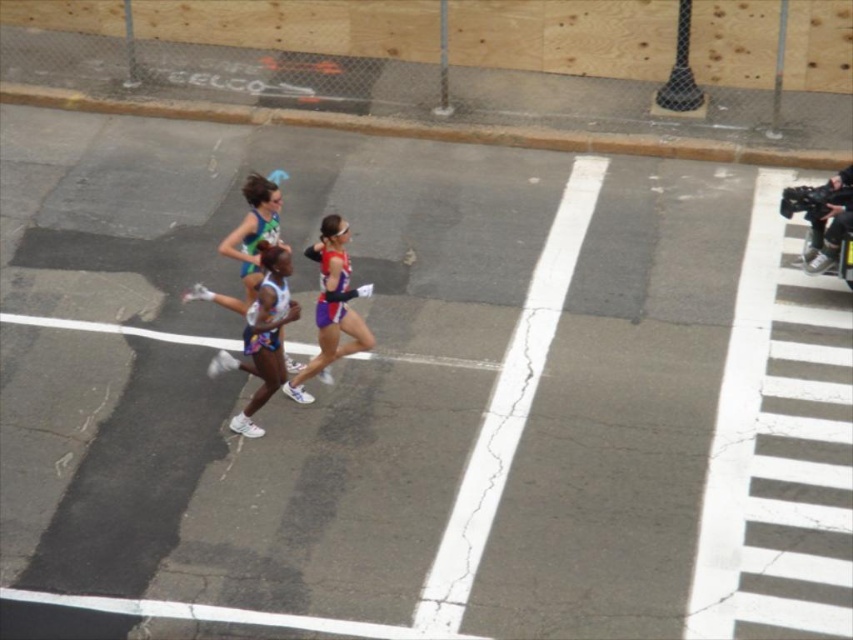
Question: Based on their relative distances, which object is farther from the white athletic wear at center?

Choices:
 (A) shiny purple shorts at center
 (B) shiny blue tank top at center

Answer: (B)

Question: Which point is closer to the camera taking this photo?

Choices:
 (A) (279, 353)
 (B) (236, 227)
 (C) (326, 298)

Answer: (C)

Question: Is white athletic wear at center below shiny blue tank top at center?

Choices:
 (A) yes
 (B) no

Answer: (A)

Question: Which is farther from the shiny purple shorts at center?

Choices:
 (A) shiny blue tank top at center
 (B) white athletic wear at center

Answer: (A)

Question: Is shiny purple shorts at center positioned at the back of shiny blue tank top at center?

Choices:
 (A) no
 (B) yes

Answer: (A)

Question: Is white athletic wear at center to the left of shiny blue tank top at center from the viewer's perspective?

Choices:
 (A) no
 (B) yes

Answer: (A)